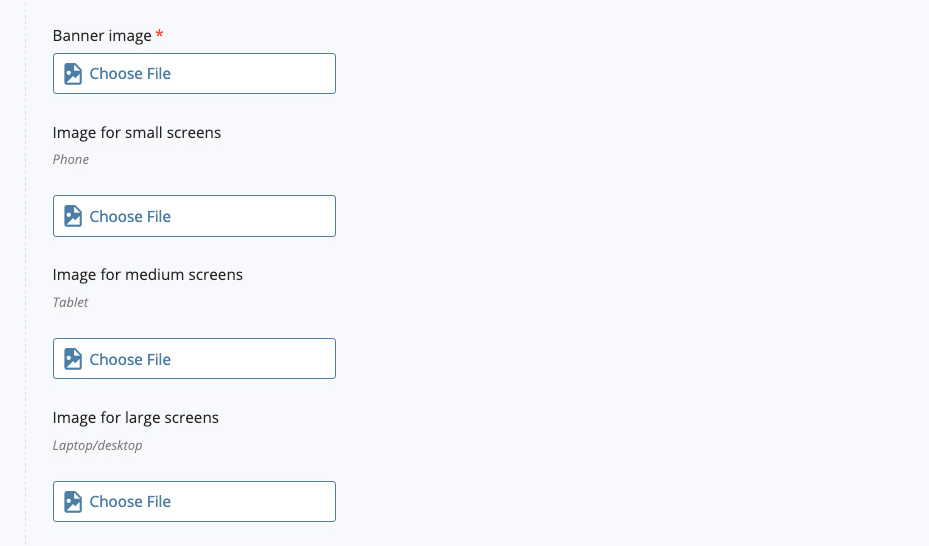
The height and width of the screenshot is (546, 929). What are the coordinates of `phone` in the screenshot? It's located at (72, 159).